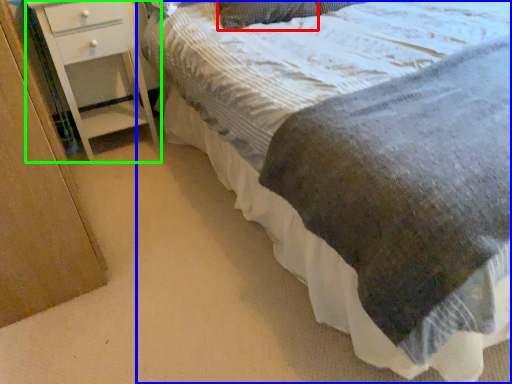
Question: Which object is the farthest from pillow (highlighted by a red box)? Choose among these: bed (highlighted by a blue box) or chest of drawers (highlighted by a green box).

Choices:
 (A) bed
 (B) chest of drawers

Answer: (B)